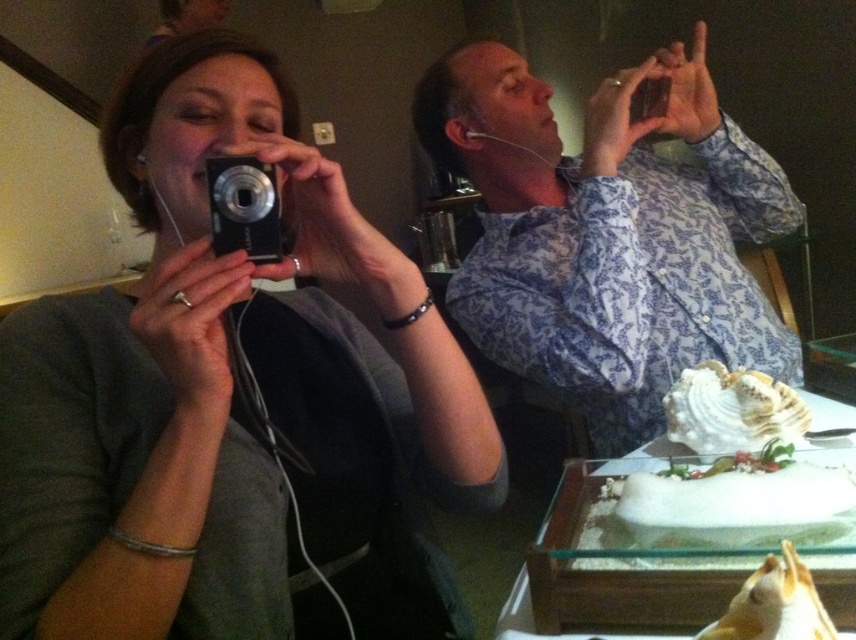
Can you confirm if blue floral shirt at upper right is positioned above white glossy shell at center?

Yes.

This screenshot has width=856, height=640. Describe the element at coordinates (607, 234) in the screenshot. I see `blue floral shirt at upper right` at that location.

Is point (491, 70) less distant than point (735, 400)?

No, it is not.

Identify the location of blue floral shirt at upper right. (607, 234).

Who is higher up, white frosted cake at center or silver metallic camera at upper center?

silver metallic camera at upper center

Can you confirm if white frosted cake at center is wider than silver metallic camera at upper center?

Correct, the width of white frosted cake at center exceeds that of silver metallic camera at upper center.

Describe the element at coordinates (736, 506) in the screenshot. I see `white frosted cake at center` at that location.

You are a GUI agent. You are given a task and a screenshot of the screen. Output one action in this format:
    pyautogui.click(x=<x>, y=<y>)
    Task: Click on the white frosted cake at center
    This screenshot has height=640, width=856.
    Given the screenshot: What is the action you would take?
    pyautogui.click(x=736, y=506)

Between white glossy shell at center and silver metallic camera at upper center, which one has more height?

white glossy shell at center is taller.

Who is more forward, (685, 424) or (218, 225)?

Point (218, 225)

I want to click on white glossy shell at center, so click(x=730, y=410).